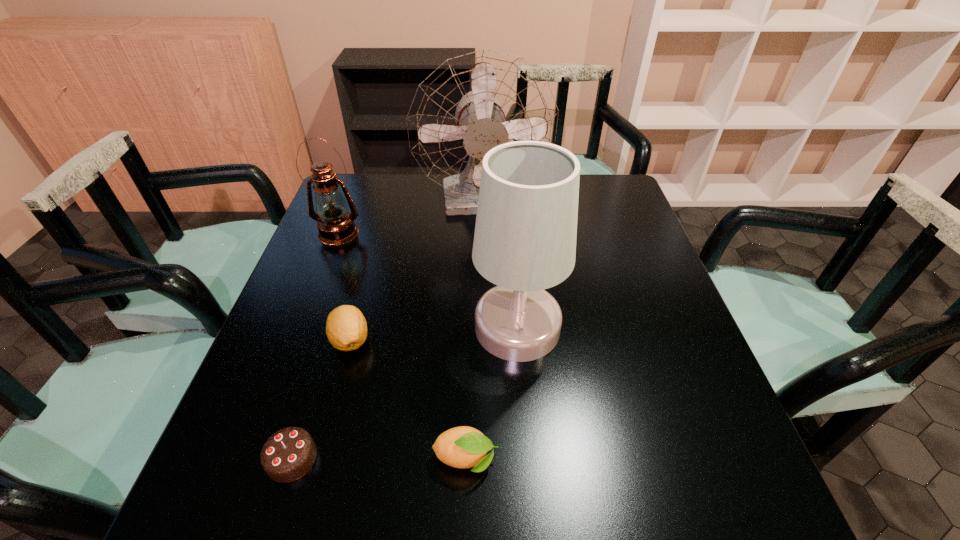
Locate an element on the screen. The width and height of the screenshot is (960, 540). object that is at the near left corner is located at coordinates (289, 454).

At what (x,y) coordinates should I click in order to perform the action: click on vacant space at the far edge. Please return your answer as a coordinate pair (x, y). This screenshot has height=540, width=960. Looking at the image, I should click on (418, 178).

Locate an element on the screen. Image resolution: width=960 pixels, height=540 pixels. vacant region at the near edge of the desktop is located at coordinates click(494, 515).

In the image, there is a desktop. Where is `vacant area at the left edge`? vacant area at the left edge is located at coordinates (231, 451).

This screenshot has width=960, height=540. I want to click on vacant space at the right edge of the desktop, so click(x=647, y=252).

You are a GUI agent. You are given a task and a screenshot of the screen. Output one action in this format:
    pyautogui.click(x=<x>, y=<y>)
    Task: Click on the free space at the far right corner of the desktop
    
    Given the screenshot: What is the action you would take?
    pyautogui.click(x=612, y=179)

Find the location of a particular element. empty space between the shortest object and the right lemon is located at coordinates (379, 459).

What are the coordinates of `free space between the chocolate cake and the third tallest object` in the screenshot? It's located at (315, 346).

Find the location of a particular element. This screenshot has width=960, height=540. free point between the lampshade and the third tallest object is located at coordinates (428, 280).

Locate an element on the screen. free area in between the fan and the left lemon is located at coordinates (417, 271).